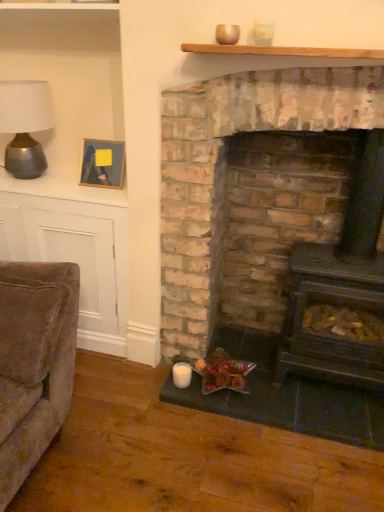
Where is `free space between matte silver table lamp at left and wooden picture frame at upper left`? free space between matte silver table lamp at left and wooden picture frame at upper left is located at coordinates (62, 186).